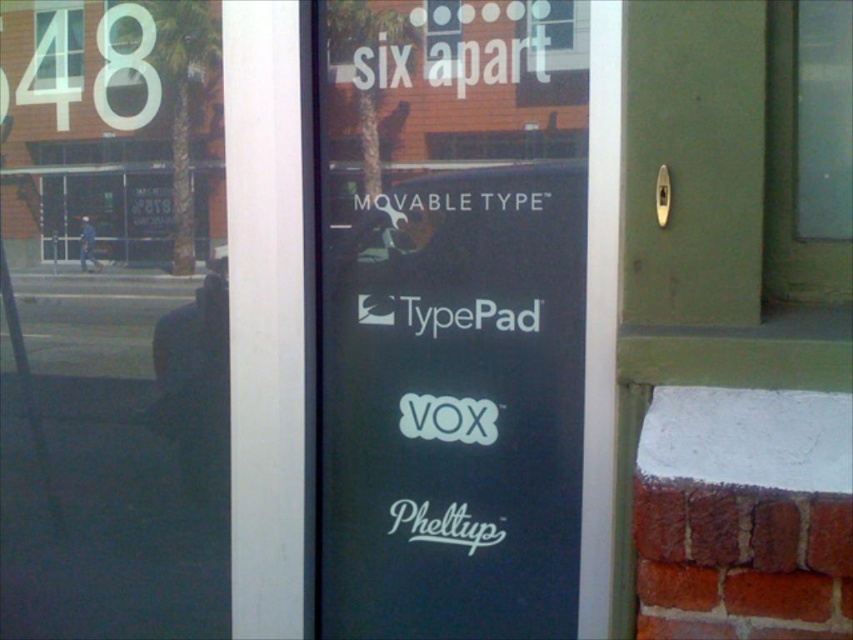
You are standing in front of the transparent glass door at left and the black matte signboard at center. Which object is closer to you?

The transparent glass door at left is closer to you because it is positioned over the black matte signboard at center, indicating it is in front.